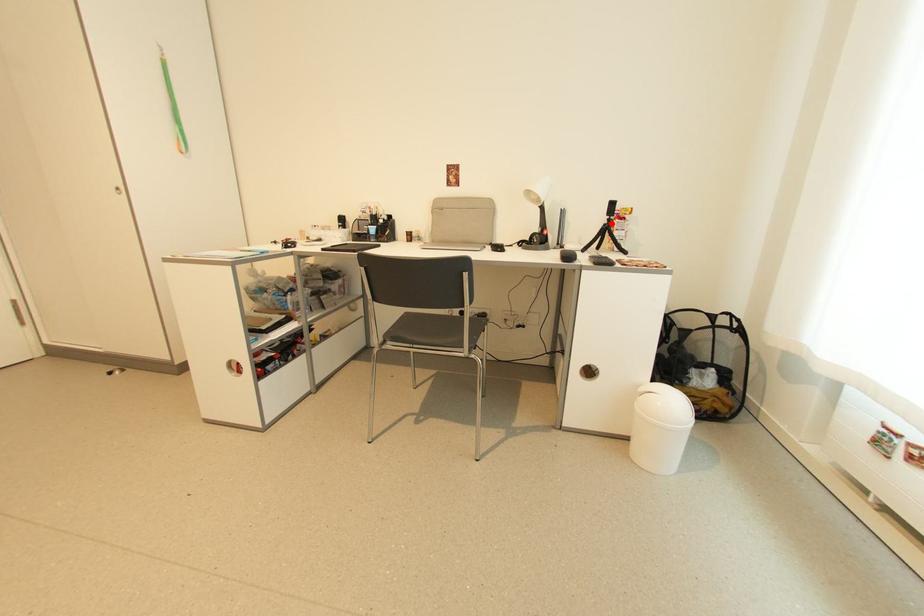
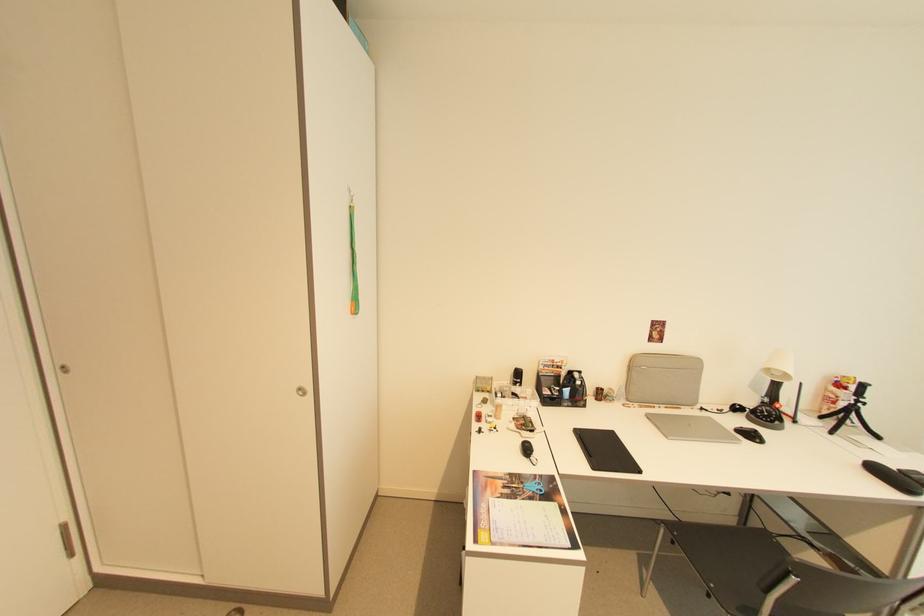
The point at the highlighted location is marked in the first image. Where is the corresponding point in the second image?

(857, 405)